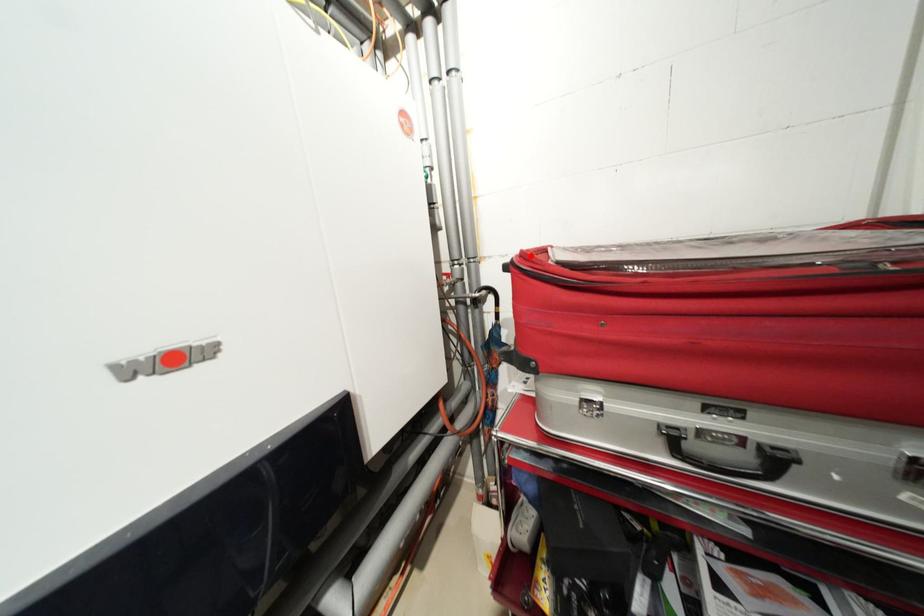
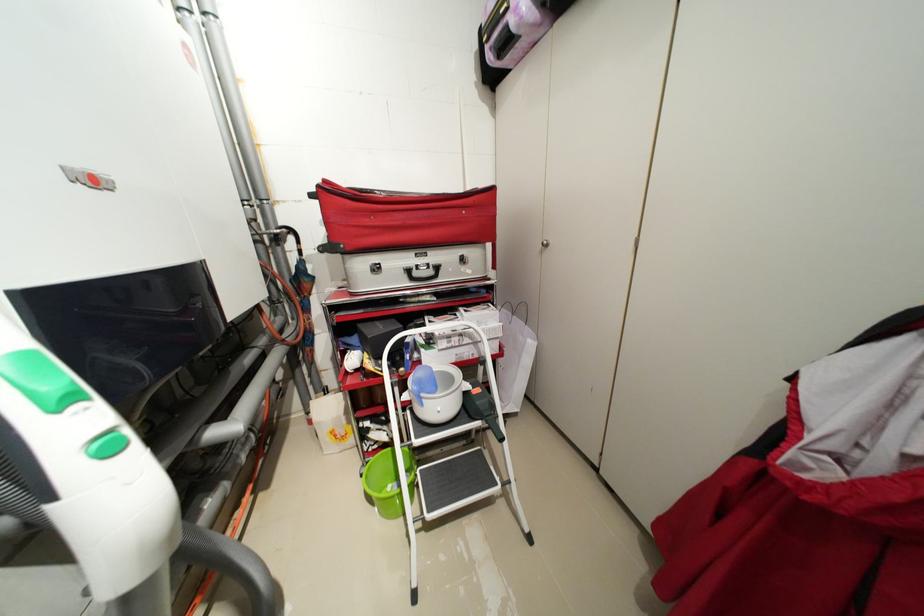
Where in the second image is the point corresponding to the highlighted location from the first image?

(332, 182)